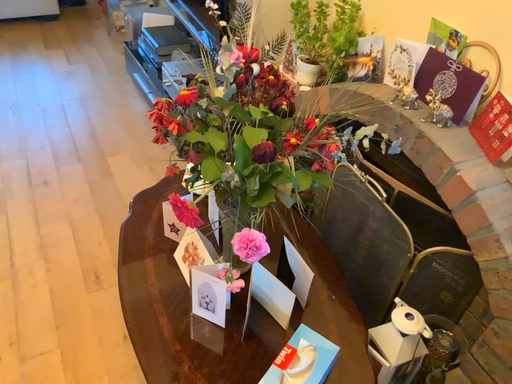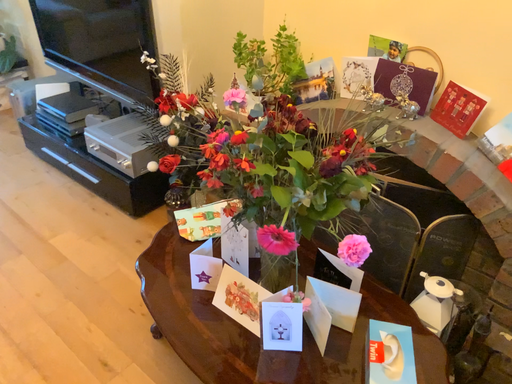
Question: Which way did the camera rotate in the video?

Choices:
 (A) rotated downward
 (B) rotated upward

Answer: (B)